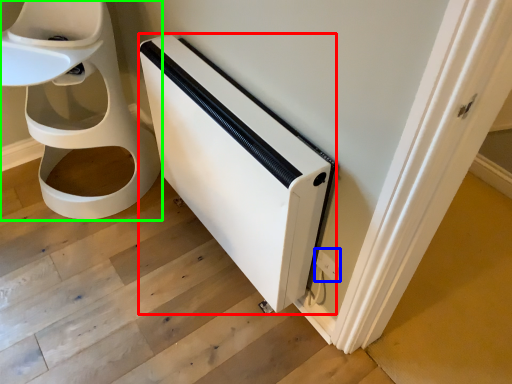
Question: Estimate the real-world distances between objects in this image. Which object is closer to appliance (highlighted by a red box), electric outlet (highlighted by a blue box) or toilet (highlighted by a green box)?

Choices:
 (A) electric outlet
 (B) toilet

Answer: (A)